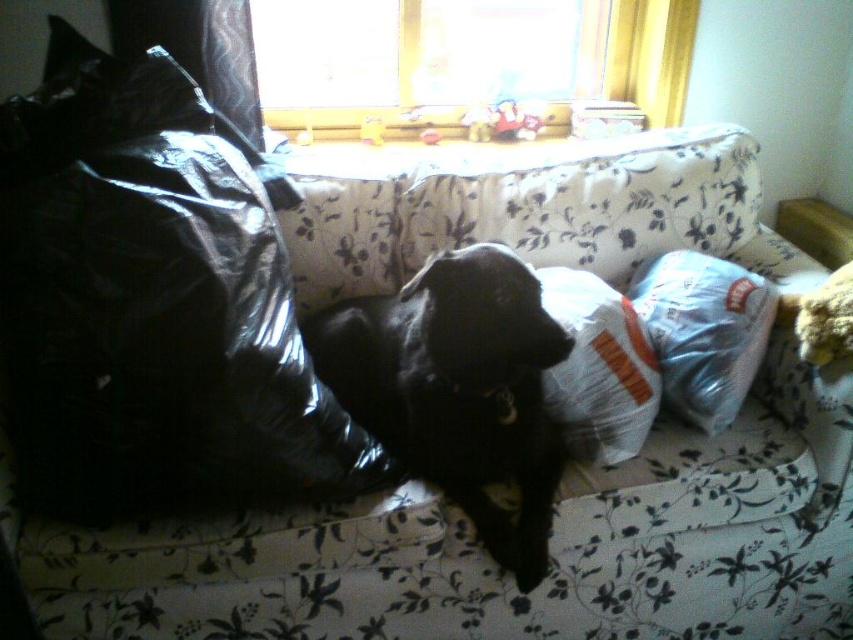
Question: Is black plastic bag at left below white fabric pillow at right?

Choices:
 (A) yes
 (B) no

Answer: (B)

Question: Can you confirm if white fabric pillow at right is smaller than white fabric pillow at center?

Choices:
 (A) no
 (B) yes

Answer: (A)

Question: Is the position of black plastic bag at left more distant than that of white fabric pillow at right?

Choices:
 (A) no
 (B) yes

Answer: (A)

Question: Which point is closer to the camera?

Choices:
 (A) white fabric pillow at right
 (B) black plastic bag at left
 (C) black matte dog at center

Answer: (C)

Question: Which object is the farthest from the black plastic bag at left?

Choices:
 (A) white fabric pillow at right
 (B) white fabric pillow at center
 (C) black matte dog at center

Answer: (A)

Question: Which of the following is the farthest from the observer?

Choices:
 (A) white fabric pillow at right
 (B) white fabric pillow at center

Answer: (A)